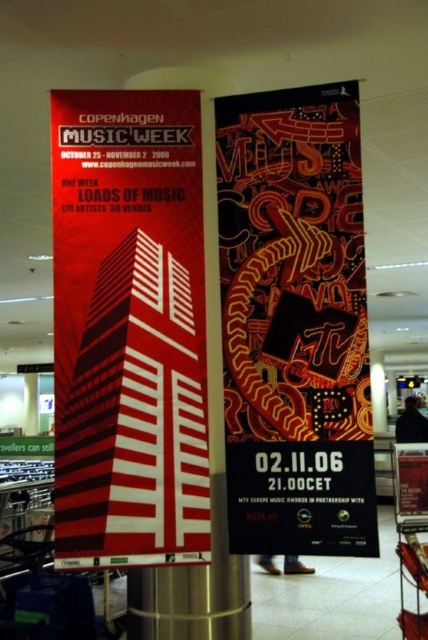
Question: Is matte red building at center in front of matte black poster at center?

Choices:
 (A) no
 (B) yes

Answer: (B)

Question: Which point appears farthest from the camera in this image?

Choices:
 (A) (321, 182)
 (B) (171, 531)

Answer: (A)

Question: Which of the following is the closest to the observer?

Choices:
 (A) matte red building at center
 (B) matte black poster at center

Answer: (A)

Question: Is matte red building at center further to the viewer compared to matte black poster at center?

Choices:
 (A) no
 (B) yes

Answer: (A)

Question: Considering the relative positions of matte red building at center and matte black poster at center in the image provided, where is matte red building at center located with respect to matte black poster at center?

Choices:
 (A) below
 (B) above

Answer: (B)